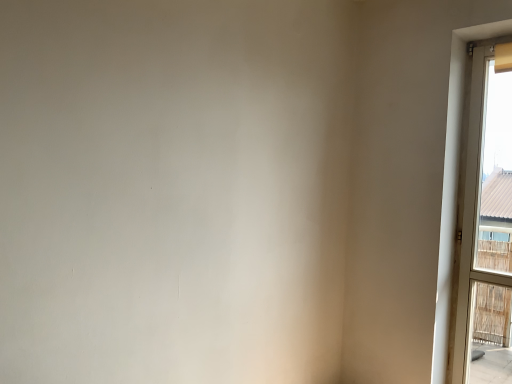
Describe the element at coordinates (485, 226) in the screenshot. The width and height of the screenshot is (512, 384). I see `white plastic window at right` at that location.

Identify the location of white plastic window at right. Image resolution: width=512 pixels, height=384 pixels. (485, 226).

At what (x,y) coordinates should I click in order to perform the action: click on white plastic window at right. Please return your answer as a coordinate pair (x, y). Looking at the image, I should click on (485, 226).